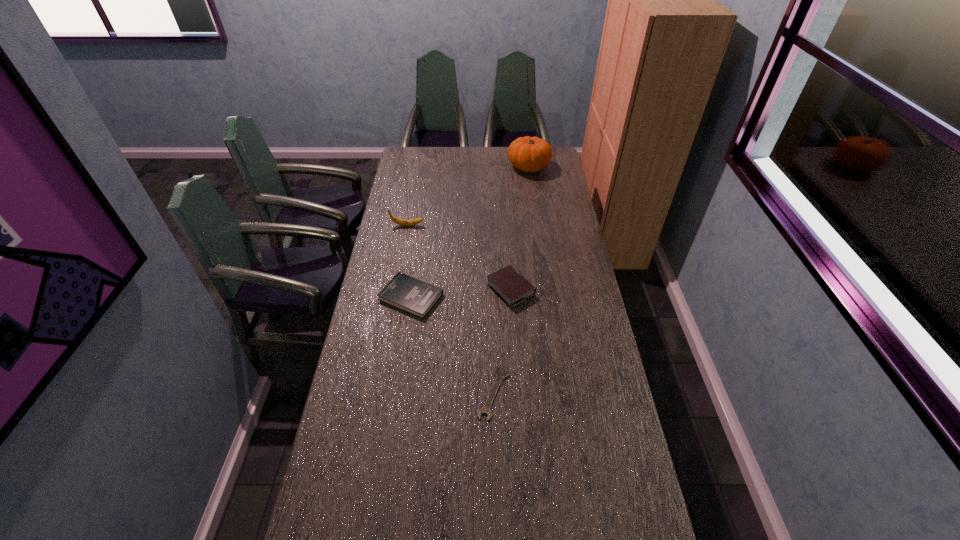
Where is `the tallest object`? The height and width of the screenshot is (540, 960). the tallest object is located at coordinates [x=530, y=154].

What are the coordinates of `pumpkin` in the screenshot? It's located at [530, 154].

Where is `the second farthest object`? The image size is (960, 540). the second farthest object is located at coordinates 402,222.

Image resolution: width=960 pixels, height=540 pixels. In order to click on banana in this screenshot , I will do `click(402, 222)`.

I want to click on Bible, so click(507, 283).

In order to click on the second shortest object in this screenshot , I will do `click(404, 292)`.

Identify the location of wrench. (500, 376).

I want to click on the shortest object, so click(500, 376).

Identify the location of vacant space situated on the left of the farthest object. The height and width of the screenshot is (540, 960). (489, 166).

I want to click on vacant area situated on the peel of the banana from the top, so click(x=484, y=226).